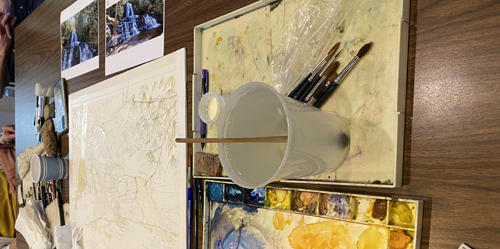
At what (x,y) coordinates should I click in order to perform the action: click on empty space on table to the right of paints. Please return your answer as a coordinate pair (x, y). Looking at the image, I should click on (429, 217).